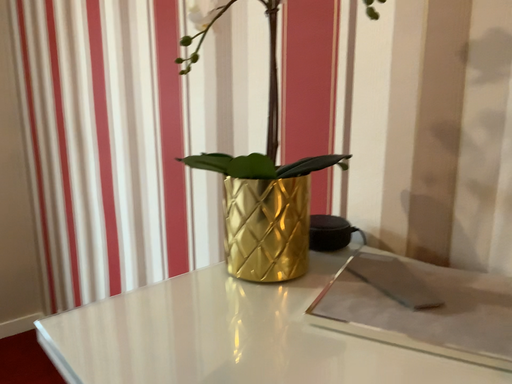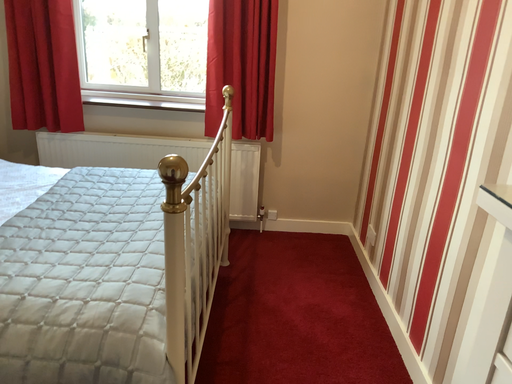
Question: Which way did the camera rotate in the video?

Choices:
 (A) rotated left
 (B) rotated right

Answer: (A)